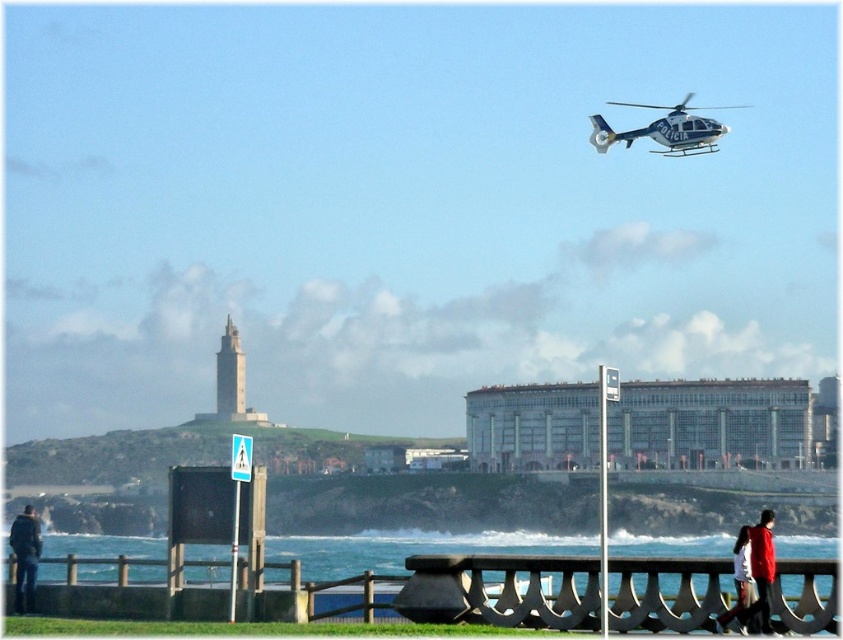
Can you confirm if red fabric jacket at lower right is thinner than dark blue jacket at lower left?

Yes.

Can you confirm if red fabric jacket at lower right is positioned above dark blue jacket at lower left?

Indeed, red fabric jacket at lower right is positioned over dark blue jacket at lower left.

Is point (755, 611) positioned in front of point (14, 595)?

Yes, it is.

Find the location of a particular element. red fabric jacket at lower right is located at coordinates (760, 573).

Between point (697, 129) and point (766, 568), which one is positioned behind?

Positioned behind is point (697, 129).

Does point (674, 108) come in front of point (766, 612)?

No, (674, 108) is further to viewer.

Who is more distant from viewer, (683, 140) or (771, 554)?

The point (683, 140) is behind.

The image size is (843, 640). What are the coordinates of `blue metallic helicopter at upper right` in the screenshot? It's located at (664, 129).

Image resolution: width=843 pixels, height=640 pixels. What do you see at coordinates (664, 129) in the screenshot?
I see `blue metallic helicopter at upper right` at bounding box center [664, 129].

Who is positioned more to the left, blue metallic helicopter at upper right or dark blue jacket at lower left?

From the viewer's perspective, dark blue jacket at lower left appears more on the left side.

You are a GUI agent. You are given a task and a screenshot of the screen. Output one action in this format:
    pyautogui.click(x=<x>, y=<y>)
    Task: Click on the blue metallic helicopter at upper right
    The height and width of the screenshot is (640, 843).
    Given the screenshot: What is the action you would take?
    pyautogui.click(x=664, y=129)